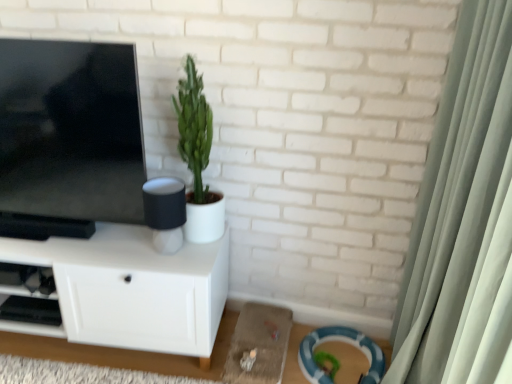
Question: Can you confirm if matte black tv at left is taller than black plastic shelf at lower left?

Choices:
 (A) yes
 (B) no

Answer: (A)

Question: Can you confirm if matte black tv at left is positioned to the right of black plastic shelf at lower left?

Choices:
 (A) yes
 (B) no

Answer: (A)

Question: From the image's perspective, is matte black tv at left below black plastic shelf at lower left?

Choices:
 (A) no
 (B) yes

Answer: (A)

Question: Can you confirm if matte black tv at left is wider than black plastic shelf at lower left?

Choices:
 (A) no
 (B) yes

Answer: (A)

Question: From the image's perspective, is matte black tv at left located above black plastic shelf at lower left?

Choices:
 (A) no
 (B) yes

Answer: (B)

Question: Looking at the image, does white matte cabinet at left seem bigger or smaller compared to matte black speaker at center?

Choices:
 (A) small
 (B) big

Answer: (B)

Question: From a real-world perspective, relative to matte black speaker at center, is white matte cabinet at left vertically above or below?

Choices:
 (A) above
 (B) below

Answer: (B)

Question: Looking at their shapes, would you say white matte cabinet at left is wider or thinner than matte black speaker at center?

Choices:
 (A) thin
 (B) wide

Answer: (B)

Question: In the image, is white matte cabinet at left on the left side or the right side of matte black speaker at center?

Choices:
 (A) left
 (B) right

Answer: (A)

Question: From a real-world perspective, is green matte plant at center physically located above or below white matte cabinet at left?

Choices:
 (A) above
 (B) below

Answer: (A)

Question: In terms of size, does green matte plant at center appear bigger or smaller than white matte cabinet at left?

Choices:
 (A) big
 (B) small

Answer: (B)

Question: Is green matte plant at center taller or shorter than white matte cabinet at left?

Choices:
 (A) short
 (B) tall

Answer: (B)

Question: In terms of width, does green matte plant at center look wider or thinner when compared to white matte cabinet at left?

Choices:
 (A) wide
 (B) thin

Answer: (B)

Question: In terms of height, does green matte plant at center look taller or shorter compared to matte black tv at left?

Choices:
 (A) tall
 (B) short

Answer: (B)

Question: From the image's perspective, is green matte plant at center positioned above or below matte black tv at left?

Choices:
 (A) below
 (B) above

Answer: (A)